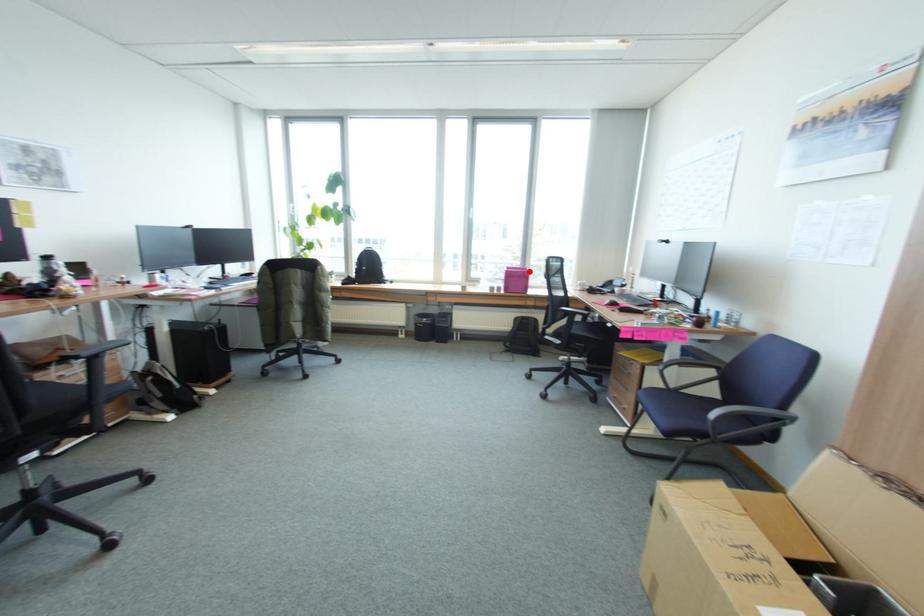
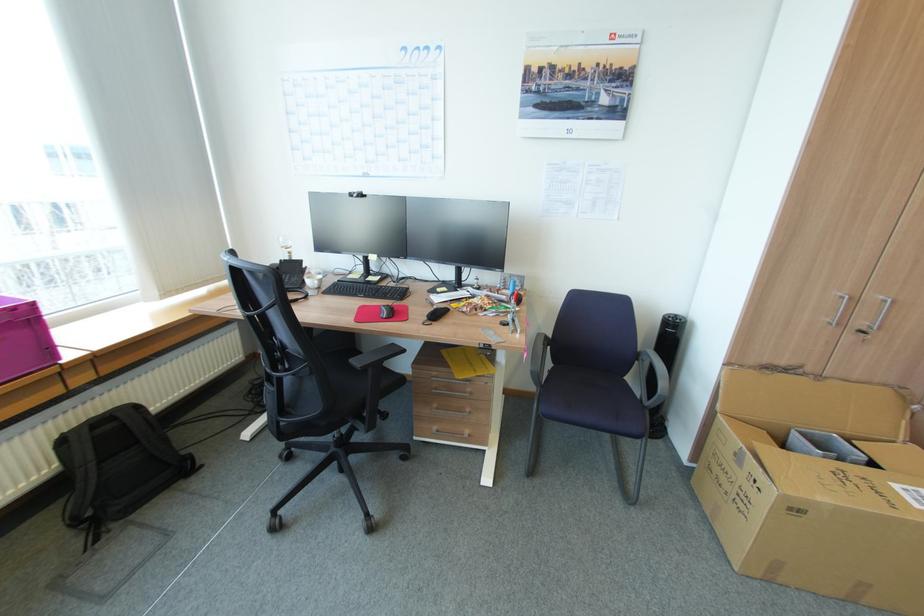
Locate, in the second image, the point that corresponds to the highlighted location in the first image.

(21, 309)